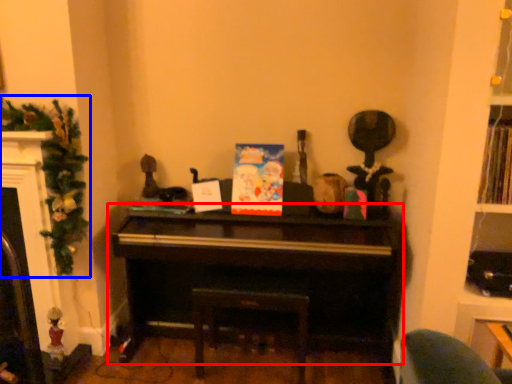
Question: Which object appears closest to the camera in this image, piano (highlighted by a red box) or christmas decoration (highlighted by a blue box)?

Choices:
 (A) piano
 (B) christmas decoration

Answer: (B)